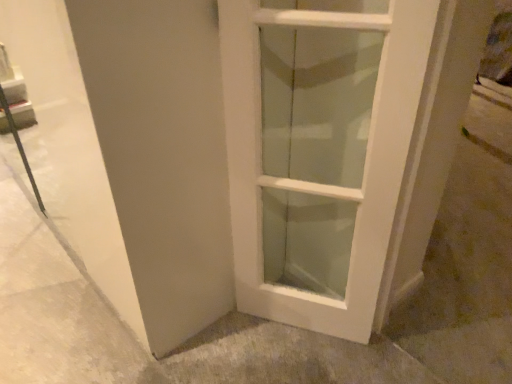
Identify the location of free space in front of white matte door at center. The height and width of the screenshot is (384, 512). (306, 356).